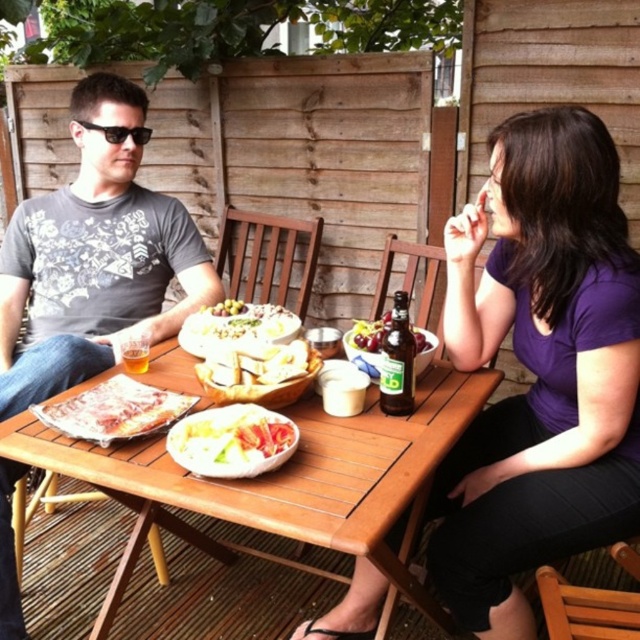
Question: Which point is closer to the camera?

Choices:
 (A) white matte plate at center
 (B) black plastic sunglasses at upper left

Answer: (A)

Question: Among these points, which one is farthest from the camera?

Choices:
 (A) (198, 321)
 (B) (532, 131)
 (C) (310, 531)

Answer: (A)

Question: Is matte gray t-shirt at left positioned behind translucent glass beer at table center?

Choices:
 (A) no
 (B) yes

Answer: (A)

Question: Does white matte plate at center have a greater width compared to green glass bottle at table center?

Choices:
 (A) yes
 (B) no

Answer: (A)

Question: Which object is farther from the camera taking this photo?

Choices:
 (A) translucent glass bottle at center
 (B) purple matte shirt at center

Answer: (A)

Question: Is wooden table at center positioned at the back of white matte plate at center?

Choices:
 (A) yes
 (B) no

Answer: (B)